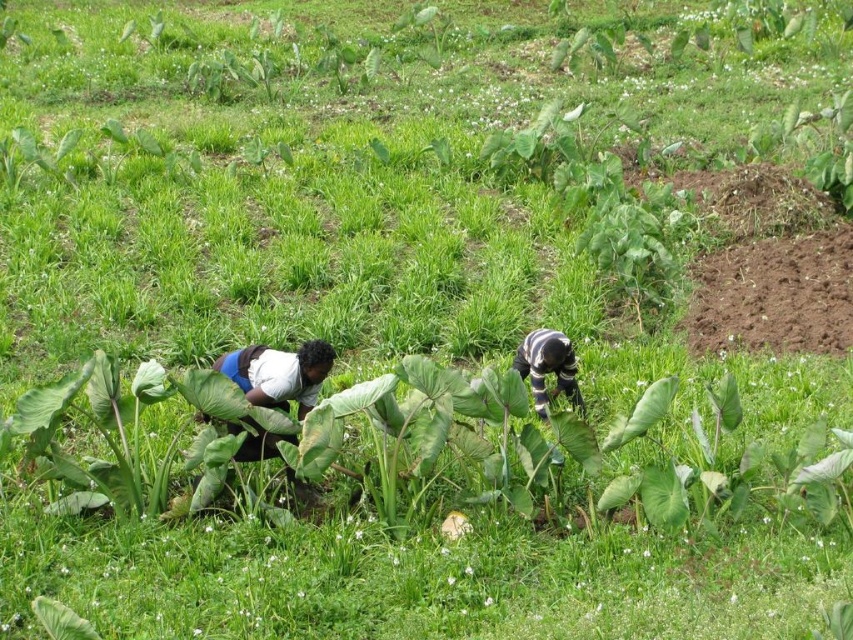
Question: Can you confirm if white cotton shirt at lower left is positioned below striped fabric person at center?

Choices:
 (A) yes
 (B) no

Answer: (A)

Question: Which point is farther to the camera?

Choices:
 (A) striped fabric person at center
 (B) white cotton shirt at lower left

Answer: (A)

Question: Is white cotton shirt at lower left to the left of striped fabric person at center from the viewer's perspective?

Choices:
 (A) no
 (B) yes

Answer: (B)

Question: Which of the following is the farthest from the observer?

Choices:
 (A) white cotton shirt at lower left
 (B) striped fabric person at center

Answer: (B)

Question: Can you confirm if white cotton shirt at lower left is positioned above striped fabric person at center?

Choices:
 (A) no
 (B) yes

Answer: (A)